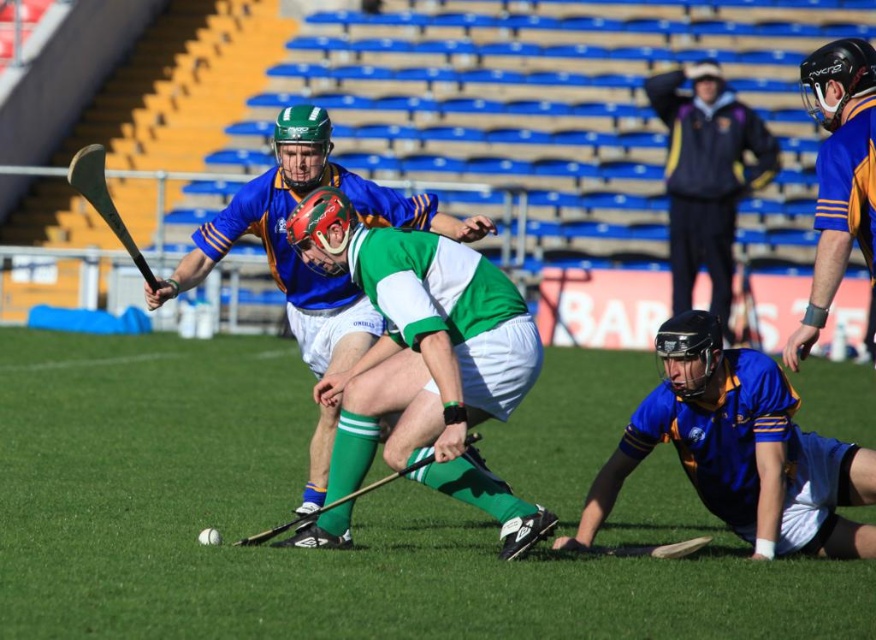
Describe the element at coordinates (425, 356) in the screenshot. I see `green matte jersey at center` at that location.

Does point (386, 372) come farther from viewer compared to point (710, 476)?

That is False.

Who is more forward, (438, 250) or (779, 500)?

Point (438, 250) is in front.

The height and width of the screenshot is (640, 876). In order to click on green matte jersey at center in this screenshot , I will do `click(425, 356)`.

Which is in front, point (368, 308) or point (673, 76)?

Point (368, 308) is in front.

Between green matte helmet at center and dark blue jacket at upper center, which one appears on the left side from the viewer's perspective?

green matte helmet at center is more to the left.

The width and height of the screenshot is (876, 640). I want to click on green matte helmet at center, so point(293,250).

Between blue jersey at lower right and dark blue jacket at upper center, which one has more height?

With more height is dark blue jacket at upper center.

Is blue jersey at lower right positioned before dark blue jacket at upper center?

Yes, blue jersey at lower right is closer to the viewer.

Measure the distance between point (x=807, y=458) and camera.

8.80 meters

Locate an element on the screen. The width and height of the screenshot is (876, 640). blue jersey at lower right is located at coordinates (739, 451).